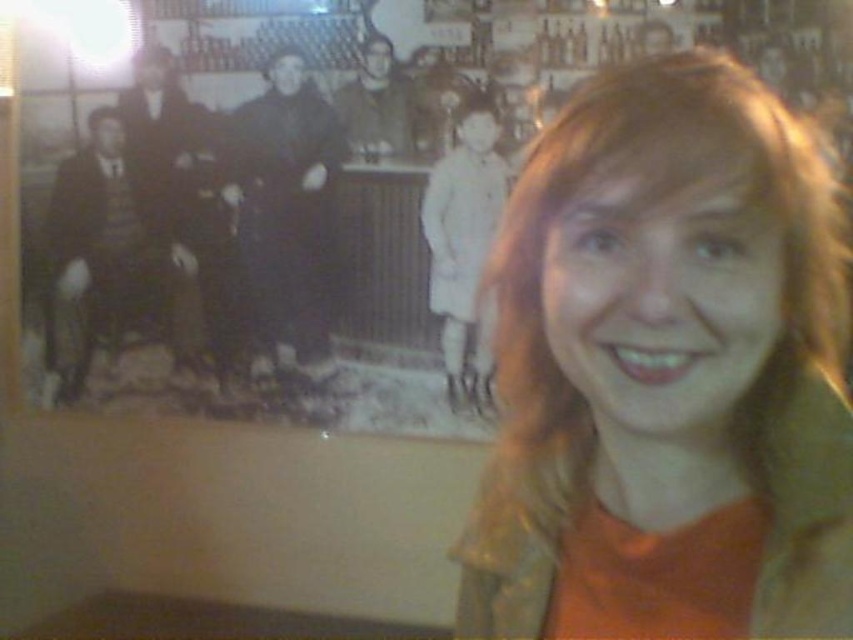
Between point (735, 285) and point (460, 348), which one is positioned in front?

Point (735, 285) is in front.

Who is higher up, orange fabric at center or light beige coat at center?

light beige coat at center is higher up.

Where is `orange fabric at center`? The height and width of the screenshot is (640, 853). orange fabric at center is located at coordinates (666, 372).

Locate an element on the screen. orange fabric at center is located at coordinates (666, 372).

Between orange fabric at center and smooth black coat at center, which one has less height?

orange fabric at center is shorter.

Between point (722, 600) and point (264, 253), which one is positioned behind?

Positioned behind is point (264, 253).

The height and width of the screenshot is (640, 853). What are the coordinates of `orange fabric at center` in the screenshot? It's located at (666, 372).

Is smooth black coat at center positioned behind light beige coat at center?

That is True.

Does smooth black coat at center have a smaller size compared to light beige coat at center?

No.

You are a GUI agent. You are given a task and a screenshot of the screen. Output one action in this format:
    pyautogui.click(x=<x>, y=<y>)
    Task: Click on the smooth black coat at center
    Image resolution: width=853 pixels, height=640 pixels.
    Given the screenshot: What is the action you would take?
    pyautogui.click(x=287, y=208)

At what (x,y) coordinates should I click in order to perform the action: click on smooth black coat at center. Please return your answer as a coordinate pair (x, y). The image size is (853, 640). Looking at the image, I should click on (287, 208).